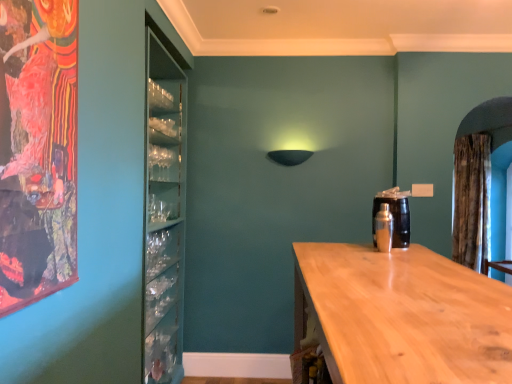
At what (x,y) coordinates should I click in order to perform the action: click on free space to the right of silver metallic shaker at right. Please return your answer as a coordinate pair (x, y). Looking at the image, I should click on (407, 246).